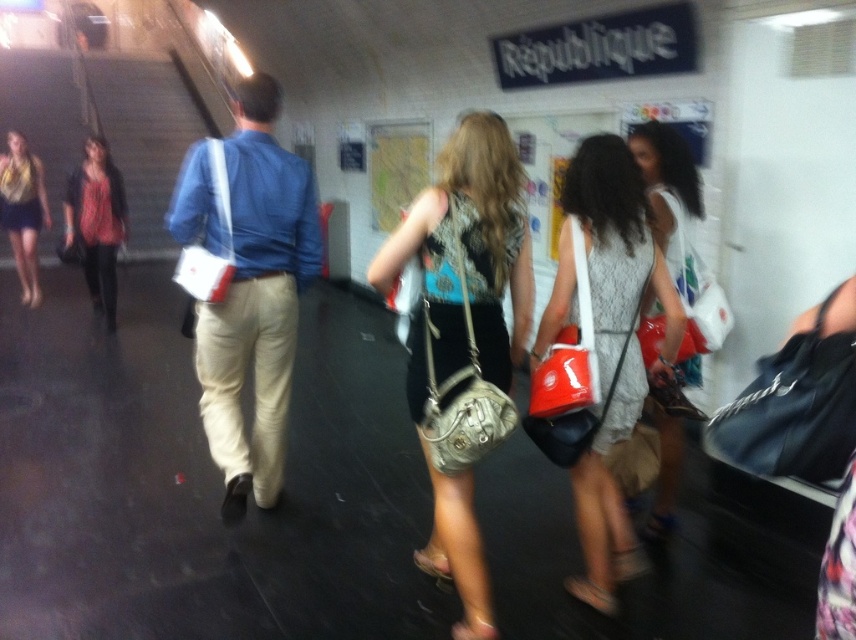
Can you confirm if metallic silver escalator at left is thinner than white fabric bag at center?

No.

Which is above, metallic silver escalator at left or white fabric bag at center?

Positioned higher is metallic silver escalator at left.

I want to click on metallic silver escalator at left, so click(x=105, y=129).

Between metallic silver escalator at left and matte black jacket at left, which one has more height?

matte black jacket at left is taller.

Can you confirm if metallic silver escalator at left is positioned below matte black jacket at left?

Actually, metallic silver escalator at left is above matte black jacket at left.

Which is in front, point (111, 72) or point (91, 176)?

Point (91, 176) is in front.

You are a GUI agent. You are given a task and a screenshot of the screen. Output one action in this format:
    pyautogui.click(x=<x>, y=<y>)
    Task: Click on the metallic silver escalator at left
    
    Given the screenshot: What is the action you would take?
    pyautogui.click(x=105, y=129)

Who is shorter, white fabric dress at center or leather-like beige purse at center?

With less height is leather-like beige purse at center.

Is white fabric dress at center behind leather-like beige purse at center?

Yes.

Between point (635, 500) and point (498, 438), which one is positioned in front?

Point (498, 438) is in front.

This screenshot has height=640, width=856. Find the location of `white fabric dress at center`. white fabric dress at center is located at coordinates (670, 196).